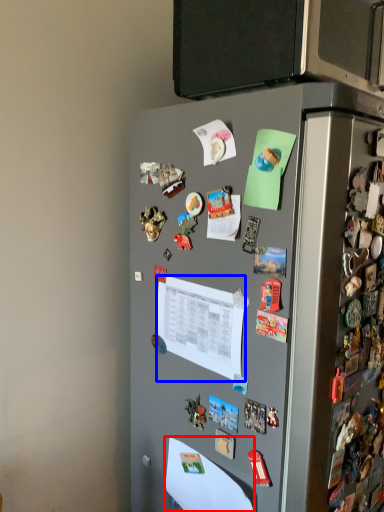
Question: Which object is closer to the camera taking this photo, paper (highlighted by a red box) or paper (highlighted by a blue box)?

Choices:
 (A) paper
 (B) paper

Answer: (B)